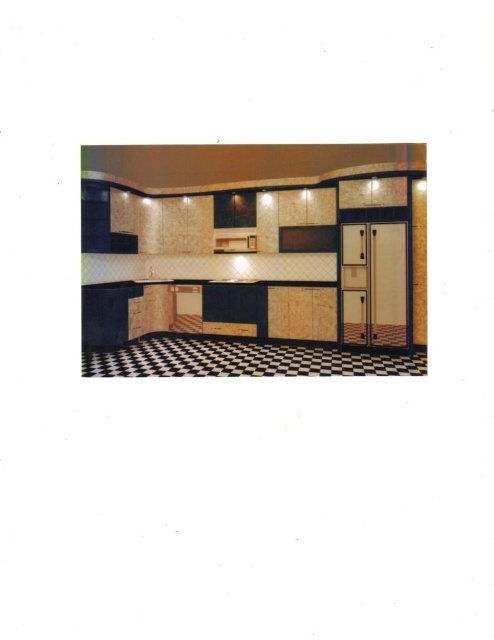
Is white glossy refrigerator at right above matte wood oven at center?

No.

Is white glossy refrigerator at right wider than matte wood oven at center?

Indeed, white glossy refrigerator at right has a greater width compared to matte wood oven at center.

Does point (370, 340) come closer to viewer compared to point (250, 237)?

Yes, point (370, 340) is in front of point (250, 237).

Image resolution: width=494 pixels, height=640 pixels. Find the location of `white glossy refrigerator at right`. white glossy refrigerator at right is located at coordinates 373,284.